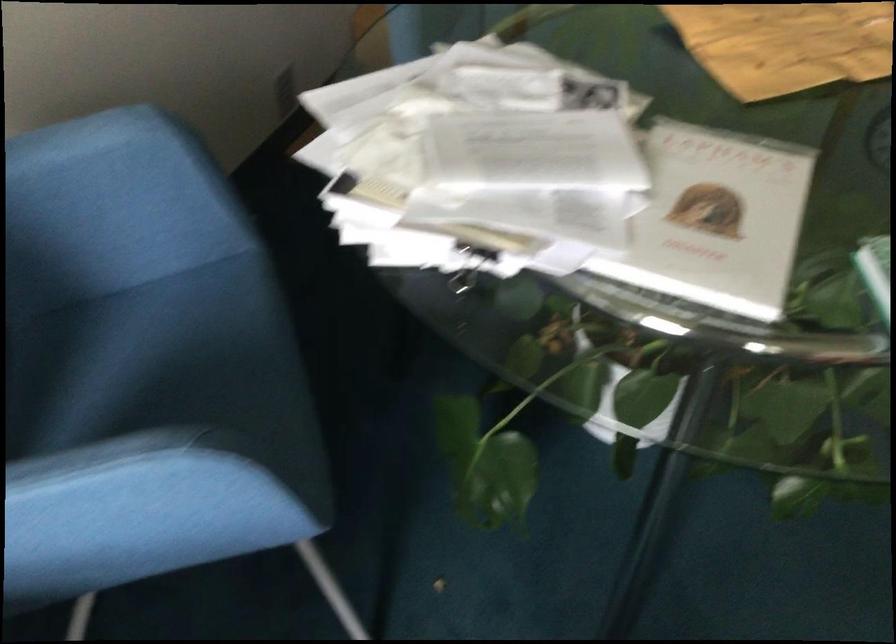
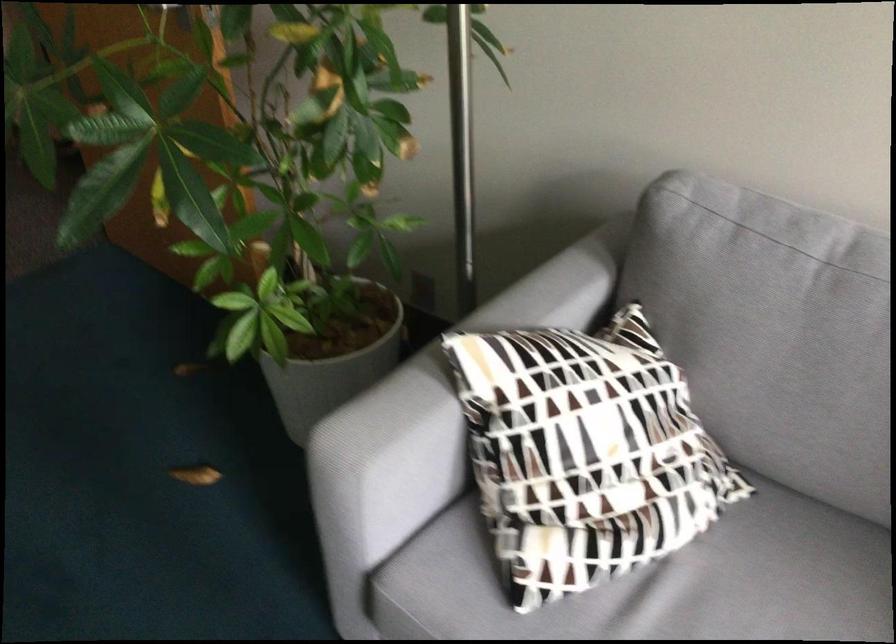
Question: The images are taken continuously from a first-person perspective. In which direction is your viewpoint rotating?

Choices:
 (A) Left
 (B) Right
 (C) Up
 (D) Down

Answer: (B)